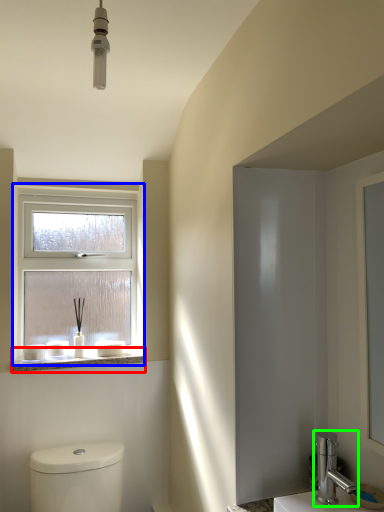
Question: Based on their relative distances, which object is nearer to window sill (highlighted by a red box)? Choose from window (highlighted by a blue box) and tap (highlighted by a green box).

Choices:
 (A) window
 (B) tap

Answer: (A)